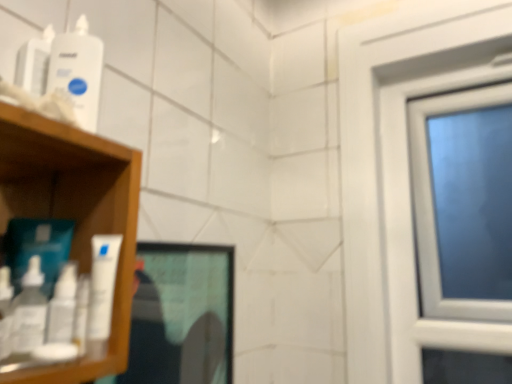
The height and width of the screenshot is (384, 512). Describe the element at coordinates (102, 284) in the screenshot. I see `white glossy tube at left, the second mouthwash ordered from the bottom` at that location.

Locate an element on the screen. This screenshot has width=512, height=384. white glossy mouthwash at left, which is the 1th mouthwash in bottom-to-top order is located at coordinates (29, 310).

This screenshot has height=384, width=512. I want to click on white glossy tube at left, the 2th mouthwash viewed from the top, so click(102, 284).

Is white glossy tube at left, the 2th mouthwash viewed from the top, aimed at white glossy mouthwash at left, placed as the third mouthwash when sorted from top to bottom?

No, white glossy tube at left, the 2th mouthwash viewed from the top, does not turn towards white glossy mouthwash at left, placed as the third mouthwash when sorted from top to bottom.

Is white glossy tube at left, the second mouthwash ordered from the bottom, bigger than white glossy mouthwash at left, placed as the third mouthwash when sorted from top to bottom?

Correct, white glossy tube at left, the second mouthwash ordered from the bottom, is larger in size than white glossy mouthwash at left, placed as the third mouthwash when sorted from top to bottom.

From a real-world perspective, which is physically above, white glossy tube at left, the second mouthwash ordered from the bottom, or white glossy mouthwash at left, placed as the third mouthwash when sorted from top to bottom?

From a 3D spatial view, white glossy tube at left, the second mouthwash ordered from the bottom, is above.

From the image's perspective, which one is positioned lower, white glossy tube at left, the 2th mouthwash viewed from the top, or white glossy mouthwash at left, which is the 1th mouthwash in bottom-to-top order?

white glossy mouthwash at left, which is the 1th mouthwash in bottom-to-top order.

Is white glossy mouthwash at left, which is the 1th mouthwash in bottom-to-top order, completely or partially outside of white glossy tube at left, the 2th mouthwash viewed from the top?

Yes, white glossy mouthwash at left, which is the 1th mouthwash in bottom-to-top order, is not within white glossy tube at left, the 2th mouthwash viewed from the top.

Which object is closer to the camera, white glossy mouthwash at left, which is the 1th mouthwash in bottom-to-top order, or white glossy tube at left, the 2th mouthwash viewed from the top?

white glossy mouthwash at left, which is the 1th mouthwash in bottom-to-top order, is in front.

Consider the image. In terms of height, does white glossy mouthwash at left, placed as the third mouthwash when sorted from top to bottom, look taller or shorter compared to white glossy tube at left, the second mouthwash ordered from the bottom?

white glossy mouthwash at left, placed as the third mouthwash when sorted from top to bottom, is shorter than white glossy tube at left, the second mouthwash ordered from the bottom.

Can you tell me how much white plastic bottle at upper left, the 3th mouthwash positioned from the bottom, and white glossy mouthwash at left, which is the 1th mouthwash in bottom-to-top order, differ in facing direction?

41.6 degrees separate the facing orientations of white plastic bottle at upper left, the 3th mouthwash positioned from the bottom, and white glossy mouthwash at left, which is the 1th mouthwash in bottom-to-top order.

Is white plastic bottle at upper left, the 3th mouthwash positioned from the bottom, spatially inside white glossy mouthwash at left, placed as the third mouthwash when sorted from top to bottom, or outside of it?

The correct answer is: outside.

Is white plastic bottle at upper left, the 3th mouthwash positioned from the bottom, aimed at white glossy mouthwash at left, placed as the third mouthwash when sorted from top to bottom?

No, white plastic bottle at upper left, the 3th mouthwash positioned from the bottom, is not facing towards white glossy mouthwash at left, placed as the third mouthwash when sorted from top to bottom.

Does white plastic bottle at upper left, which is the first mouthwash in top-to-bottom order, have a lesser width compared to white glossy mouthwash at left, which is the 1th mouthwash in bottom-to-top order?

In fact, white plastic bottle at upper left, which is the first mouthwash in top-to-bottom order, might be wider than white glossy mouthwash at left, which is the 1th mouthwash in bottom-to-top order.

Which is less distant, [89,338] or [96,89]?

Point [89,338] is positioned closer to the camera compared to point [96,89].

Which of these two, white glossy tube at left, the 2th mouthwash viewed from the top, or white plastic bottle at upper left, the 3th mouthwash positioned from the bottom, stands shorter?

white glossy tube at left, the 2th mouthwash viewed from the top, is shorter.

Is white glossy tube at left, the 2th mouthwash viewed from the top, wider or thinner than white plastic bottle at upper left, which is the first mouthwash in top-to-bottom order?

In the image, white glossy tube at left, the 2th mouthwash viewed from the top, appears to be more narrow than white plastic bottle at upper left, which is the first mouthwash in top-to-bottom order.

Find the location of `mouthwash that appears above the white glossy tube at left, the 2th mouthwash viewed from the top (from a real-world perspective)`. mouthwash that appears above the white glossy tube at left, the 2th mouthwash viewed from the top (from a real-world perspective) is located at coordinates (78, 71).

Considering the positions of point (56, 42) and point (99, 296), is point (56, 42) closer or farther from the camera than point (99, 296)?

Point (56, 42) is farther from the camera than point (99, 296).

From a real-world perspective, which object stands above the other?

white plastic bottle at upper left, which is the first mouthwash in top-to-bottom order.

From the picture: Does white plastic bottle at upper left, which is the first mouthwash in top-to-bottom order, touch white glossy tube at left, the second mouthwash ordered from the bottom?

No, white plastic bottle at upper left, which is the first mouthwash in top-to-bottom order, is not touching white glossy tube at left, the second mouthwash ordered from the bottom.

Considering the positions of objects white plastic bottle at upper left, the 3th mouthwash positioned from the bottom, and white glossy tube at left, the 2th mouthwash viewed from the top, in the image provided, who is more to the left, white plastic bottle at upper left, the 3th mouthwash positioned from the bottom, or white glossy tube at left, the 2th mouthwash viewed from the top,?

From the viewer's perspective, white plastic bottle at upper left, the 3th mouthwash positioned from the bottom, appears more on the left side.

Does white glossy mouthwash at left, placed as the third mouthwash when sorted from top to bottom, touch white plastic bottle at upper left, which is the first mouthwash in top-to-bottom order?

There is a gap between white glossy mouthwash at left, placed as the third mouthwash when sorted from top to bottom, and white plastic bottle at upper left, which is the first mouthwash in top-to-bottom order.

From the image's perspective, starting from the white plastic bottle at upper left, the 3th mouthwash positioned from the bottom, which mouthwash is the 2nd one below? Please provide its 2D coordinates.

[(29, 310)]

How distant is white glossy mouthwash at left, placed as the third mouthwash when sorted from top to bottom, from white plastic bottle at upper left, the 3th mouthwash positioned from the bottom?

white glossy mouthwash at left, placed as the third mouthwash when sorted from top to bottom, is 10.31 inches away from white plastic bottle at upper left, the 3th mouthwash positioned from the bottom.

Is white plastic bottle at upper left, which is the first mouthwash in top-to-bottom order, a part of white glossy mouthwash at left, placed as the third mouthwash when sorted from top to bottom?

No, white plastic bottle at upper left, which is the first mouthwash in top-to-bottom order, is not surrounded by white glossy mouthwash at left, placed as the third mouthwash when sorted from top to bottom.

You are a GUI agent. You are given a task and a screenshot of the screen. Output one action in this format:
    pyautogui.click(x=<x>, y=<y>)
    Task: Click on the mouthwash that is under the white glossy tube at left, the 2th mouthwash viewed from the top (from a real-world perspective)
    
    Given the screenshot: What is the action you would take?
    pyautogui.click(x=29, y=310)

At what (x,y) coordinates should I click in order to perform the action: click on the 2nd mouthwash to the right of the white glossy mouthwash at left, which is the 1th mouthwash in bottom-to-top order, starting your count from the anchor. Please return your answer as a coordinate pair (x, y). The image size is (512, 384). Looking at the image, I should click on (102, 284).

When comparing their distances from white plastic bottle at upper left, the 3th mouthwash positioned from the bottom, does white glossy mouthwash at left, placed as the third mouthwash when sorted from top to bottom, or white glossy tube at left, the 2th mouthwash viewed from the top, seem further?

The object further to white plastic bottle at upper left, the 3th mouthwash positioned from the bottom, is white glossy mouthwash at left, placed as the third mouthwash when sorted from top to bottom.

Considering their positions, is white glossy tube at left, the 2th mouthwash viewed from the top, positioned further to white glossy mouthwash at left, which is the 1th mouthwash in bottom-to-top order, than white plastic bottle at upper left, the 3th mouthwash positioned from the bottom?

white plastic bottle at upper left, the 3th mouthwash positioned from the bottom, lies further to white glossy mouthwash at left, which is the 1th mouthwash in bottom-to-top order, than the other object.

Based on their spatial positions, is white glossy tube at left, the 2th mouthwash viewed from the top, or white glossy mouthwash at left, which is the 1th mouthwash in bottom-to-top order, further from white plastic bottle at upper left, which is the first mouthwash in top-to-bottom order?

The object further to white plastic bottle at upper left, which is the first mouthwash in top-to-bottom order, is white glossy mouthwash at left, which is the 1th mouthwash in bottom-to-top order.

Considering their positions, is white plastic bottle at upper left, the 3th mouthwash positioned from the bottom, positioned further to white glossy tube at left, the 2th mouthwash viewed from the top, than white glossy mouthwash at left, placed as the third mouthwash when sorted from top to bottom?

Among the two, white plastic bottle at upper left, the 3th mouthwash positioned from the bottom, is located further to white glossy tube at left, the 2th mouthwash viewed from the top.

Which object lies further to the anchor point white glossy mouthwash at left, which is the 1th mouthwash in bottom-to-top order, white plastic bottle at upper left, the 3th mouthwash positioned from the bottom, or white glossy tube at left, the second mouthwash ordered from the bottom?

white plastic bottle at upper left, the 3th mouthwash positioned from the bottom, is further to white glossy mouthwash at left, which is the 1th mouthwash in bottom-to-top order.

Based on their spatial positions, is white glossy mouthwash at left, placed as the third mouthwash when sorted from top to bottom, or white plastic bottle at upper left, the 3th mouthwash positioned from the bottom, further from white glossy tube at left, the second mouthwash ordered from the bottom?

Based on the image, white plastic bottle at upper left, the 3th mouthwash positioned from the bottom, appears to be further to white glossy tube at left, the second mouthwash ordered from the bottom.

You are a GUI agent. You are given a task and a screenshot of the screen. Output one action in this format:
    pyautogui.click(x=<x>, y=<y>)
    Task: Click on the mouthwash between white plastic bottle at upper left, the 3th mouthwash positioned from the bottom, and white glossy mouthwash at left, placed as the third mouthwash when sorted from top to bottom, in the up-down direction
    This screenshot has width=512, height=384.
    Given the screenshot: What is the action you would take?
    pyautogui.click(x=102, y=284)